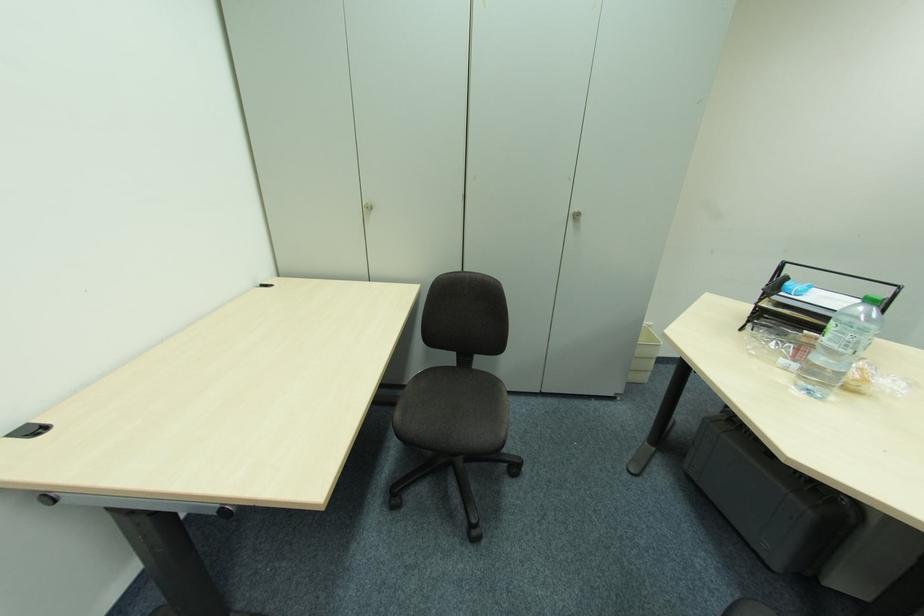
What do you see at coordinates (458, 394) in the screenshot? I see `a chair sitting surface` at bounding box center [458, 394].